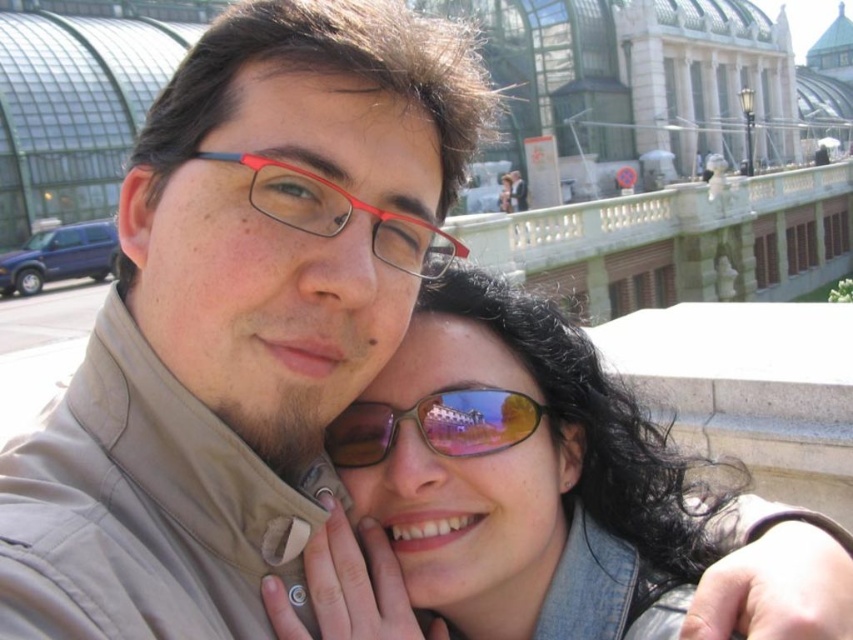
You are a photographer adjusting your camera settings to focus on both the brown reflective sunglasses at center and the matte plastic glasses at center in the image. Which object should you focus on first to ensure proper depth of field?

You should focus on the brown reflective sunglasses at center first because it is closer to the viewer than the matte plastic glasses at center, allowing for better depth of field adjustment.

You are trying to decide which item is closer to the left edge of the photo. You see the matte beige jacket at center and the matte black sunglasses at center. Which one is positioned more to the left?

The matte beige jacket at center is positioned more to the left than the matte black sunglasses at center according to the description.